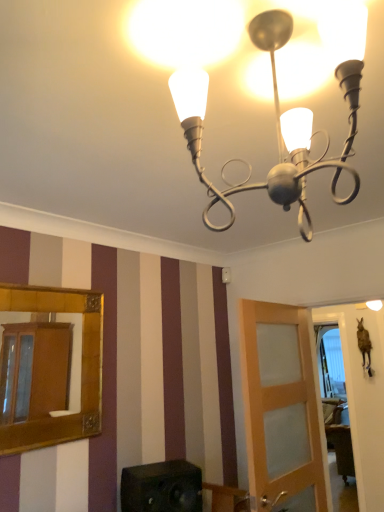
Question: From the image's perspective, would you say black matte speaker at lower center is shown under gold-framed mirror at left?

Choices:
 (A) yes
 (B) no

Answer: (A)

Question: Can you confirm if black matte speaker at lower center is positioned to the right of gold-framed mirror at left?

Choices:
 (A) no
 (B) yes

Answer: (B)

Question: Can you confirm if black matte speaker at lower center is wider than gold-framed mirror at left?

Choices:
 (A) no
 (B) yes

Answer: (B)

Question: Can you see black matte speaker at lower center touching gold-framed mirror at left?

Choices:
 (A) no
 (B) yes

Answer: (A)

Question: Can you confirm if black matte speaker at lower center is smaller than gold-framed mirror at left?

Choices:
 (A) yes
 (B) no

Answer: (B)

Question: Considering the relative positions of black matte speaker at lower center and gold-framed mirror at left in the image provided, is black matte speaker at lower center to the left of gold-framed mirror at left from the viewer's perspective?

Choices:
 (A) yes
 (B) no

Answer: (B)

Question: Is black matte speaker at lower center positioned before light brown wooden door at center?

Choices:
 (A) no
 (B) yes

Answer: (B)

Question: Is black matte speaker at lower center touching light brown wooden door at center?

Choices:
 (A) yes
 (B) no

Answer: (B)

Question: Does black matte speaker at lower center have a smaller size compared to light brown wooden door at center?

Choices:
 (A) no
 (B) yes

Answer: (B)

Question: Is black matte speaker at lower center looking in the opposite direction of light brown wooden door at center?

Choices:
 (A) yes
 (B) no

Answer: (B)

Question: Can you confirm if black matte speaker at lower center is bigger than light brown wooden door at center?

Choices:
 (A) no
 (B) yes

Answer: (A)

Question: Could you tell me if black matte speaker at lower center is facing light brown wooden door at center?

Choices:
 (A) no
 (B) yes

Answer: (A)

Question: Is metallic silver chandelier at upper center looking in the opposite direction of gold-framed mirror at left?

Choices:
 (A) yes
 (B) no

Answer: (B)